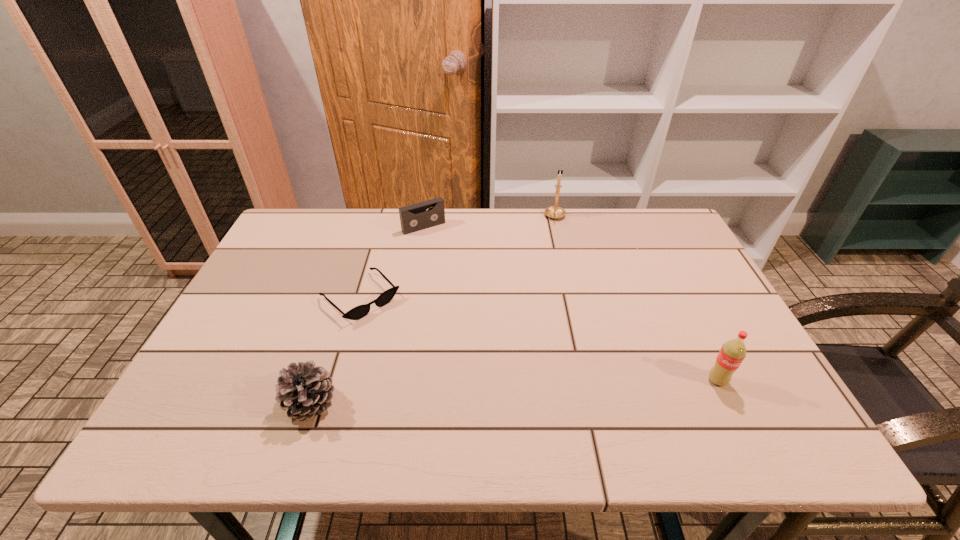
Locate an element on the screen. soda that is positioned at the near edge is located at coordinates (733, 352).

Find the location of a particular element. The image size is (960, 540). object that is at the right edge is located at coordinates (733, 352).

This screenshot has height=540, width=960. I want to click on object that is positioned at the near right corner, so click(733, 352).

In the image, there is a desktop. At what (x,y) coordinates should I click in order to perform the action: click on vacant space at the far edge. Please return your answer as a coordinate pair (x, y). Looking at the image, I should click on (596, 225).

Image resolution: width=960 pixels, height=540 pixels. I want to click on vacant point at the near edge, so pyautogui.click(x=348, y=390).

You are a GUI agent. You are given a task and a screenshot of the screen. Output one action in this format:
    pyautogui.click(x=<x>, y=<y>)
    Task: Click on the free spot at the left edge of the desktop
    
    Given the screenshot: What is the action you would take?
    pyautogui.click(x=248, y=348)

This screenshot has height=540, width=960. Identify the location of vacant space at the right edge of the desktop. (682, 296).

The height and width of the screenshot is (540, 960). Find the location of `vacant space at the far left corner`. vacant space at the far left corner is located at coordinates (284, 231).

Where is `blank space at the far right corner of the desktop`? The image size is (960, 540). blank space at the far right corner of the desktop is located at coordinates (635, 219).

Identify the location of vacant point at the near right corner. The width and height of the screenshot is (960, 540). (735, 406).